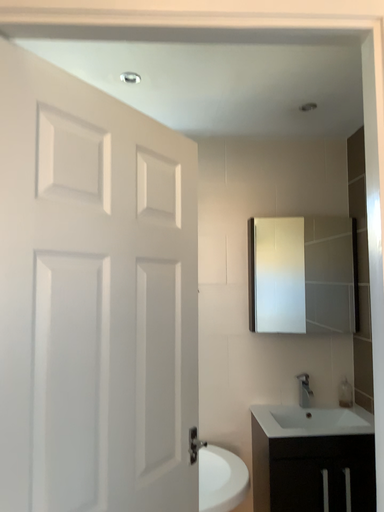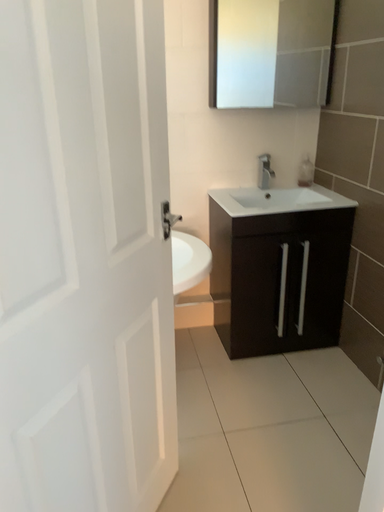
Question: How did the camera likely rotate when shooting the video?

Choices:
 (A) rotated upward
 (B) rotated downward

Answer: (B)